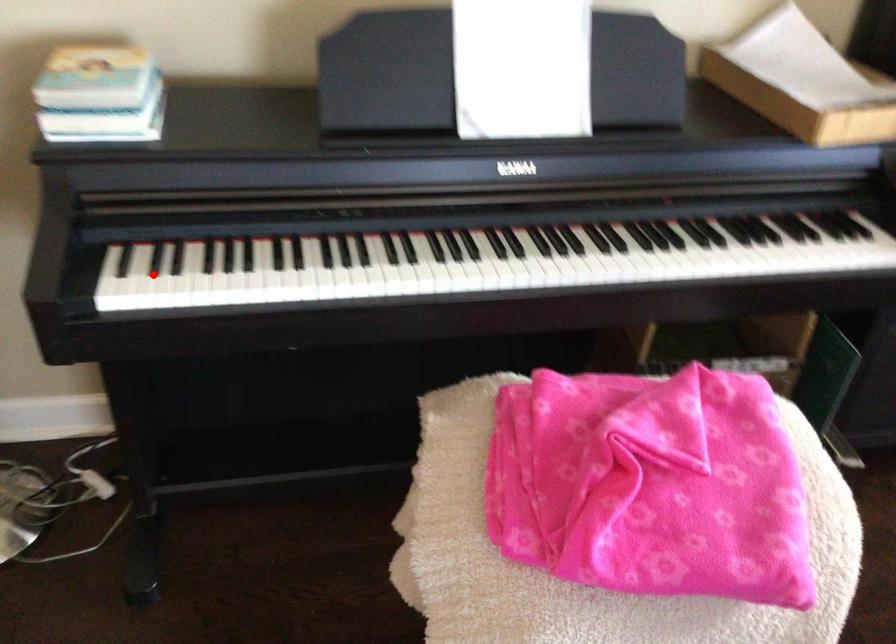
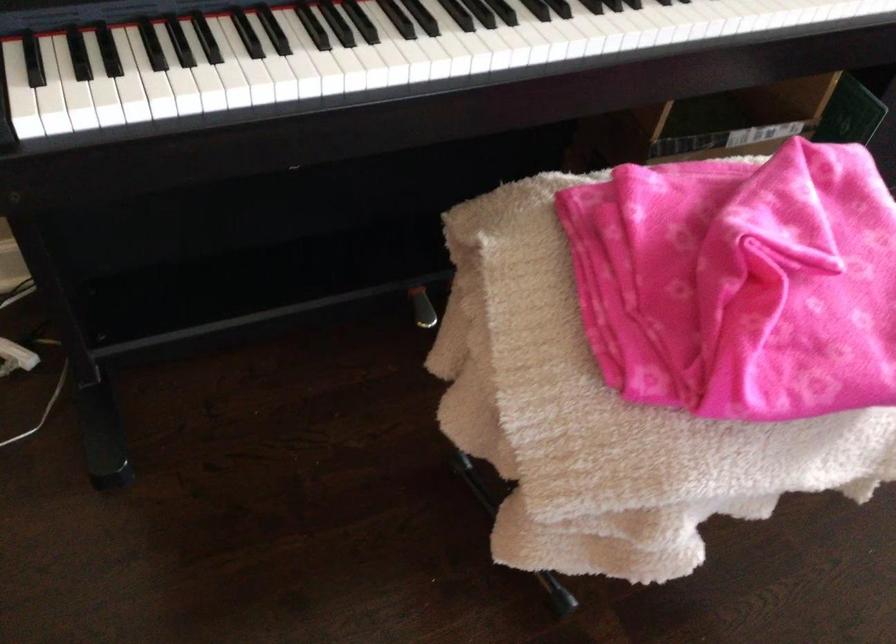
Question: I am providing you with two images of the same scene from different viewpoints. Image1 has a red point marked. In image2, the corresponding 3D location appears at what relative position? Reply with the corresponding letter.

Choices:
 (A) Closer
 (B) Farther

Answer: (A)